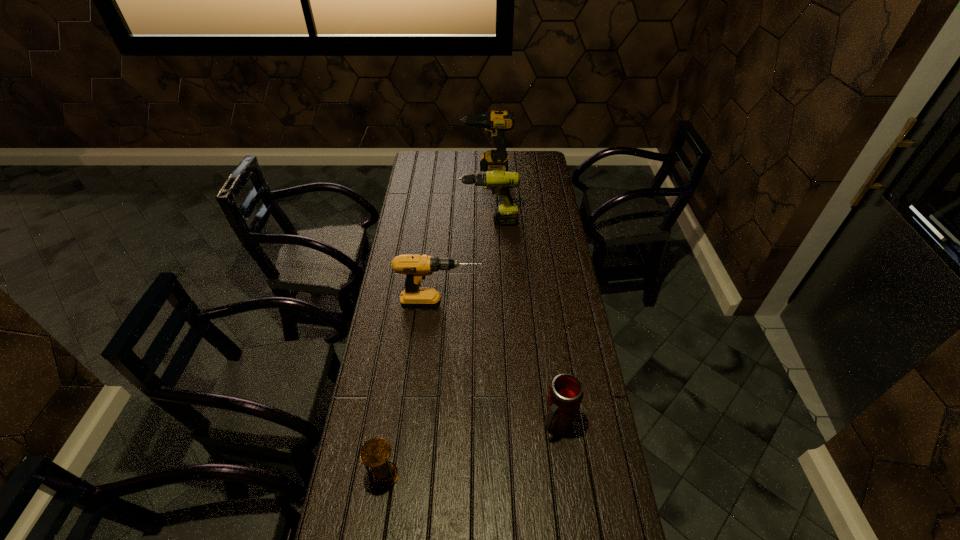
Find the location of a particular element. The width and height of the screenshot is (960, 540). the tallest object is located at coordinates (495, 123).

This screenshot has width=960, height=540. Find the location of `the tallest drill`. the tallest drill is located at coordinates (495, 123).

The width and height of the screenshot is (960, 540). Find the location of `the fourth nearest object`. the fourth nearest object is located at coordinates (499, 181).

I want to click on the nearest drill, so (416, 267).

You are a GUI agent. You are given a task and a screenshot of the screen. Output one action in this format:
    pyautogui.click(x=<x>, y=<y>)
    Task: Click on the thermos bottle
    Image resolution: width=960 pixels, height=540 pixels.
    Given the screenshot: What is the action you would take?
    pyautogui.click(x=565, y=395)

You are a GUI agent. You are given a task and a screenshot of the screen. Output one action in this format:
    pyautogui.click(x=<x>, y=<y>)
    Task: Click on the fourth tallest object
    The height and width of the screenshot is (540, 960).
    Given the screenshot: What is the action you would take?
    pyautogui.click(x=565, y=395)

Where is `hourglass`? This screenshot has width=960, height=540. hourglass is located at coordinates (375, 453).

Find the location of a particular element. This screenshot has width=960, height=540. the nearest object is located at coordinates (375, 453).

Identify the location of vacant space located 0.060m at the tip of the farthest object. The image size is (960, 540). (450, 169).

Identify the location of vacant position located at the tip of the farthest object. (448, 169).